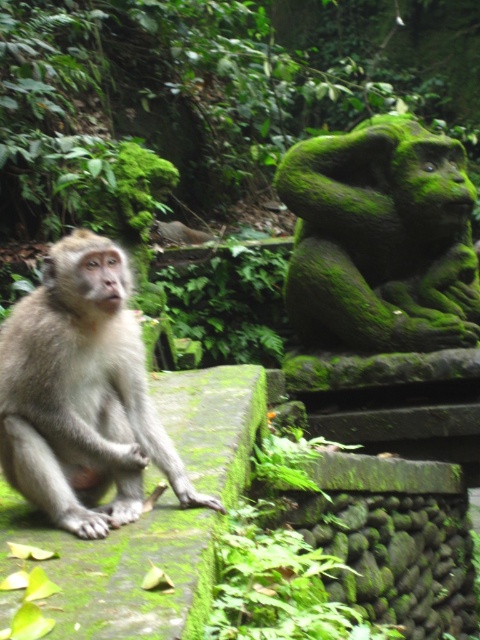
Does green mossy statue at right appear under light brown fur monkey at center?

Incorrect, green mossy statue at right is not positioned below light brown fur monkey at center.

Is green mossy statue at right above light brown fur monkey at center?

Correct, green mossy statue at right is located above light brown fur monkey at center.

Between point (392, 243) and point (58, 470), which one is positioned in front?

Positioned in front is point (58, 470).

The width and height of the screenshot is (480, 640). I want to click on green mossy statue at right, so click(x=381, y=240).